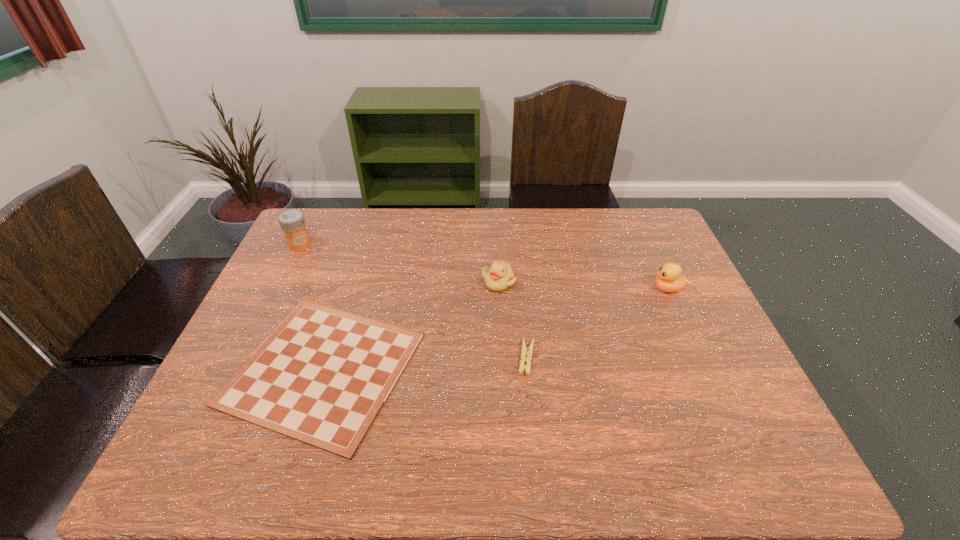
This screenshot has height=540, width=960. Identify the location of vacant space situated on the beak of the left duckling. (501, 329).

Where is `vacant space located on the front of the clothespin`? The image size is (960, 540). vacant space located on the front of the clothespin is located at coordinates (534, 433).

You are a GUI agent. You are given a task and a screenshot of the screen. Output one action in this format:
    pyautogui.click(x=<x>, y=<y>)
    Task: Click on the free space located on the right of the checkerboard
    
    Given the screenshot: What is the action you would take?
    pyautogui.click(x=511, y=368)

Find the location of a particular element. The height and width of the screenshot is (540, 960). object positioned at the far edge is located at coordinates (292, 222).

Locate an element on the screen. object that is positioned at the near edge is located at coordinates (323, 375).

You are a GUI agent. You are given a task and a screenshot of the screen. Output one action in this format:
    pyautogui.click(x=<x>, y=<y>)
    Task: Click on the medicine positioned at the left edge
    
    Given the screenshot: What is the action you would take?
    pyautogui.click(x=292, y=222)

The width and height of the screenshot is (960, 540). I want to click on checkerboard located at the left edge, so click(323, 375).

Find the location of a particular element. object present at the right edge is located at coordinates (669, 279).

Identify the location of object positioned at the far left corner. click(292, 222).

Find the location of a particular element. The image size is (960, 540). object that is at the near left corner is located at coordinates (323, 375).